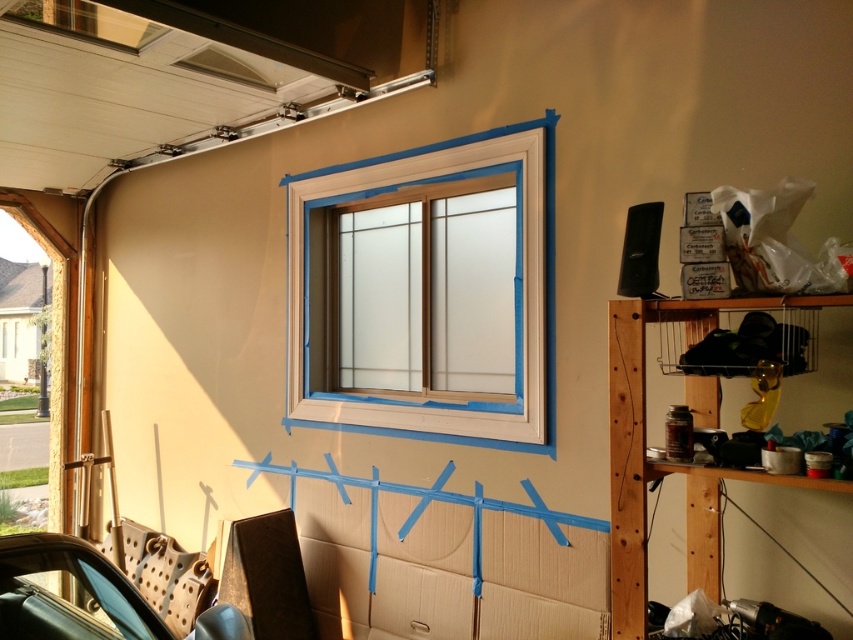
Which is in front, point (311, 273) or point (149, 605)?

Point (149, 605)

Is beige wood window frame at center smaller than teal leather car seat at lower left?

No, beige wood window frame at center is not smaller than teal leather car seat at lower left.

Identify the location of beige wood window frame at center. The width and height of the screenshot is (853, 640). (332, 298).